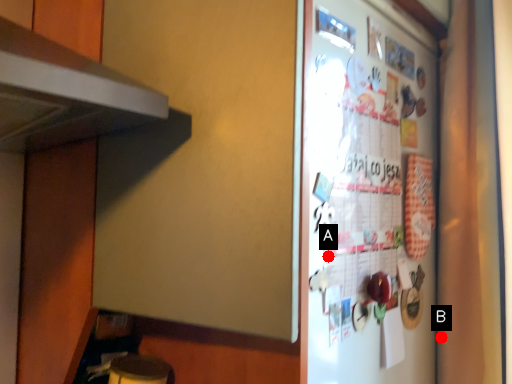
Question: Two points are circled on the image, labeled by A and B beside each circle. Which point is farther to the camera?

Choices:
 (A) A is further
 (B) B is further

Answer: (B)